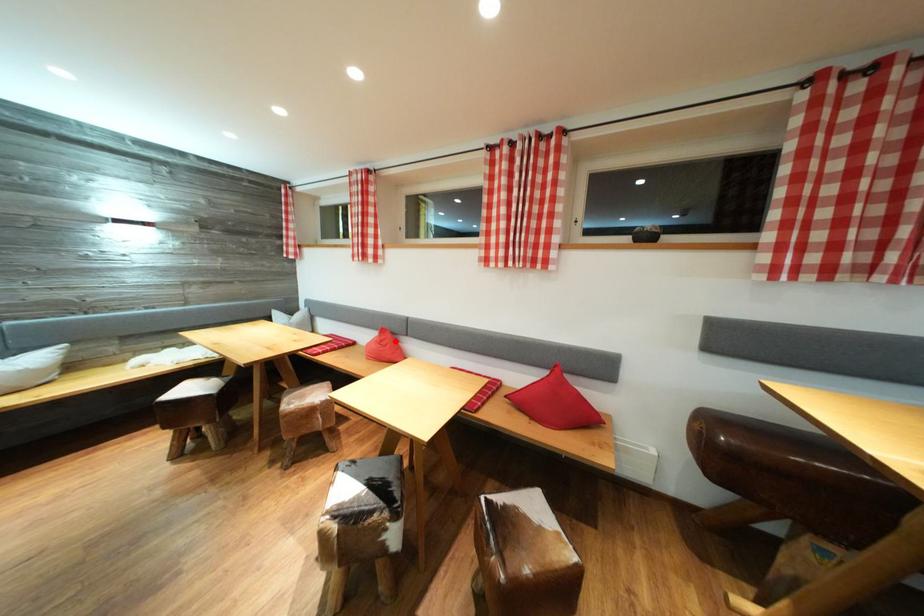
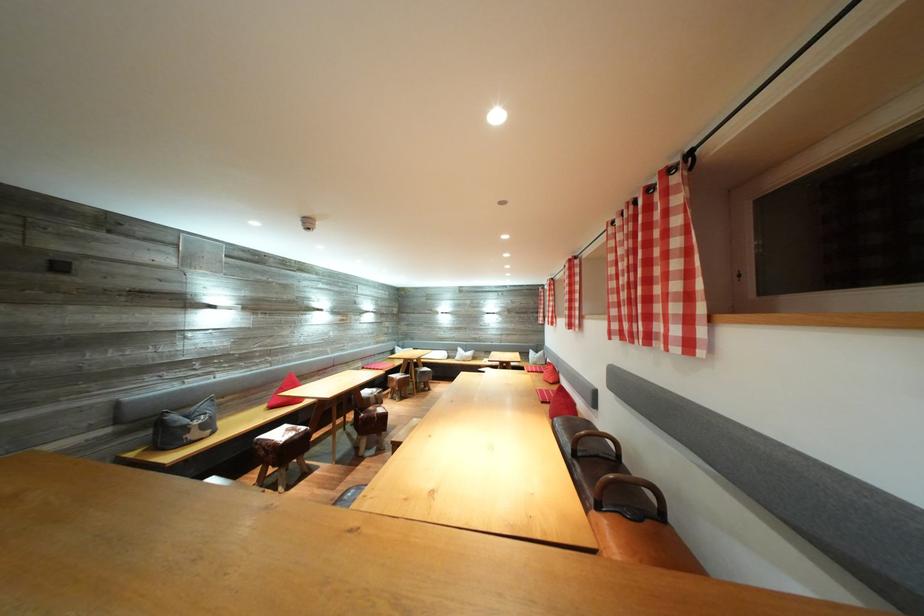
Question: I am providing you with two images of the same scene from different viewpoints. A red point is marked on the first image. At the location where the point appears in image 1, is it still visible in image 2?

Choices:
 (A) Yes
 (B) No

Answer: (A)